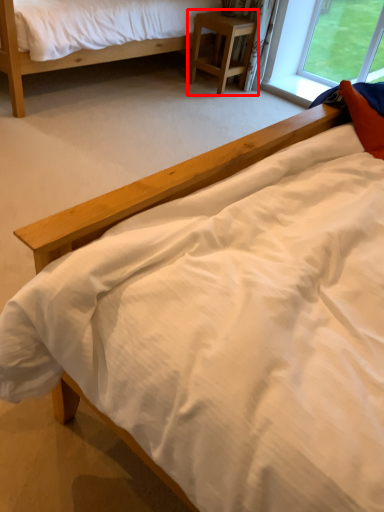
Question: From the image's perspective, where is nightstand (annotated by the red box) located relative to bed?

Choices:
 (A) below
 (B) above

Answer: (A)